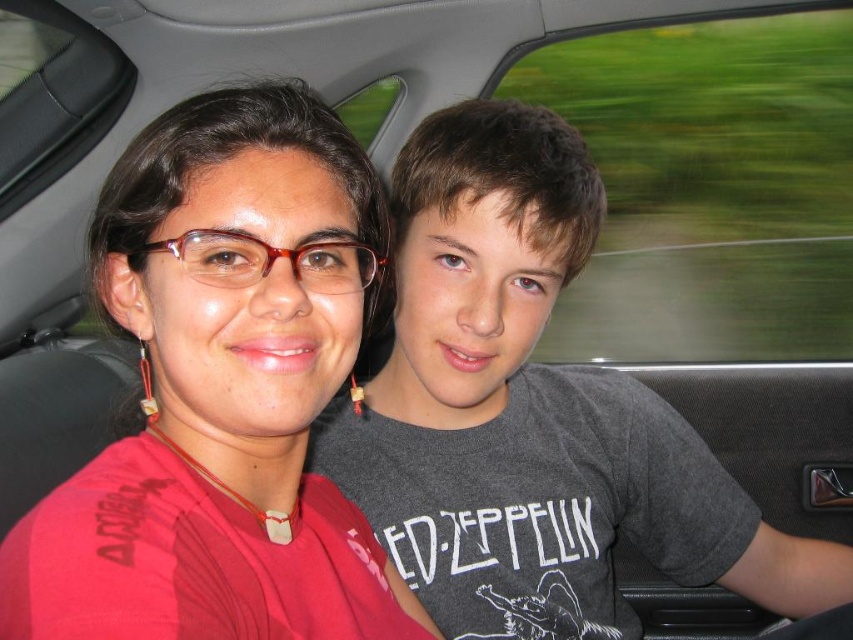
Question: Which object is the closest to the transparent glass window at upper right?

Choices:
 (A) matte red glasses at center
 (B) transparent glass car window at upper left

Answer: (B)

Question: Is matte red glasses at center closer to camera compared to transparent glass car window at upper left?

Choices:
 (A) yes
 (B) no

Answer: (A)

Question: Which object is closer to the camera taking this photo?

Choices:
 (A) matte red glasses at center
 (B) transparent glass window at upper right

Answer: (A)

Question: Can you confirm if matte red glasses at center is smaller than transparent glass car window at upper left?

Choices:
 (A) yes
 (B) no

Answer: (A)

Question: Which of the following is the closest to the observer?

Choices:
 (A) (828, 120)
 (B) (22, 83)

Answer: (B)

Question: From the image, what is the correct spatial relationship of matte red glasses at center in relation to transparent glass car window at upper left?

Choices:
 (A) above
 (B) below

Answer: (B)